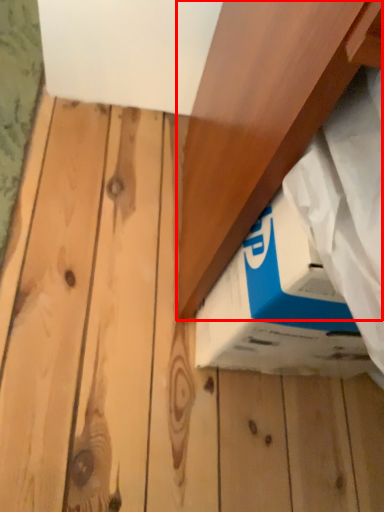
Question: From the image's perspective, where is plank (annotated by the red box) located in relation to box in the image?

Choices:
 (A) above
 (B) below

Answer: (A)